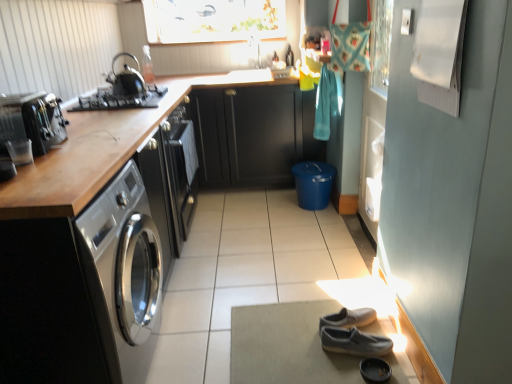
Question: From their relative heights in the image, would you say satin black toaster at left is taller or shorter than gray suede shoes at lower center?

Choices:
 (A) short
 (B) tall

Answer: (B)

Question: In the image, is satin black toaster at left positioned in front of or behind gray suede shoes at lower center?

Choices:
 (A) behind
 (B) front

Answer: (B)

Question: Estimate the real-world distances between objects in this image. Which object is closer to the black leather shoe at lower center?

Choices:
 (A) shiny black kettle at upper left
 (B) gray suede shoes at lower center
 (C) gray suede shoes at lower right
 (D) matte glass window screen at upper center
 (E) satin black cabinet at left, which appears as the second cabinetry when viewed from the back

Answer: (C)

Question: Which of these objects is positioned farthest from the satin black toaster at left?

Choices:
 (A) black leather shoe at lower center
 (B) black matte gas stove at upper left
 (C) gray suede shoes at lower right
 (D) shiny black kettle at upper left
 (E) matte glass window screen at upper center

Answer: (E)